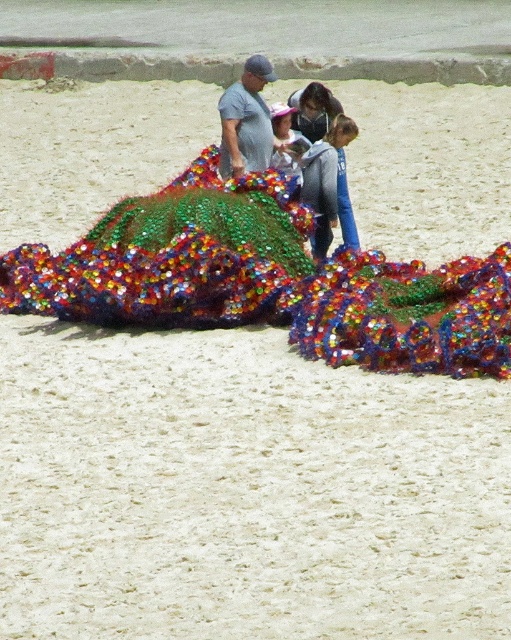
You are a photographer standing at the beach and want to take a photo of the matte plastic man at center and the matte pink hat at center. Which object should you focus on first to ensure both are in frame?

The matte plastic man at center is in front of the matte pink hat at center, so you should focus on the matte plastic man at center first to ensure both are in frame.